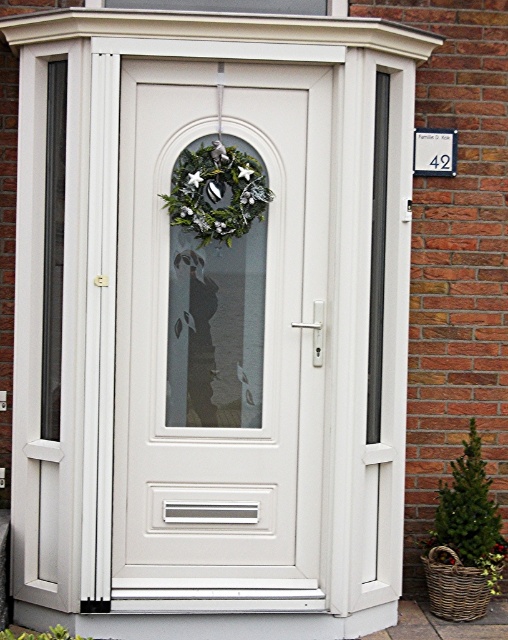
Question: Which object is positioned farthest from the white glossy door at center?

Choices:
 (A) transparent glass window at upper center
 (B) green matte wreath at center

Answer: (A)

Question: Estimate the real-world distances between objects in this image. Which object is farther from the white glossy door at center?

Choices:
 (A) transparent glass window at upper center
 (B) green matte wreath at center

Answer: (A)

Question: Does white glossy door at center have a larger size compared to green matte wreath at center?

Choices:
 (A) no
 (B) yes

Answer: (B)

Question: Is green matte wreath at center bigger than transparent glass window at upper center?

Choices:
 (A) yes
 (B) no

Answer: (B)

Question: Which object is positioned farthest from the transparent glass window at upper center?

Choices:
 (A) white glossy door at center
 (B) green matte wreath at center

Answer: (A)

Question: Is green matte wreath at center closer to camera compared to transparent glass window at upper center?

Choices:
 (A) yes
 (B) no

Answer: (A)